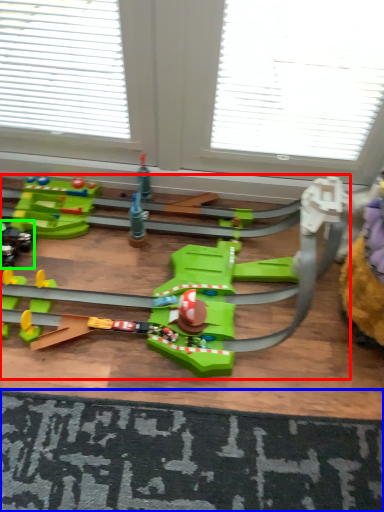
Question: Based on their relative distances, which object is farther from toy (highlighted by a red box)? Choose from doormat (highlighted by a blue box) and toy (highlighted by a green box).

Choices:
 (A) doormat
 (B) toy

Answer: (B)